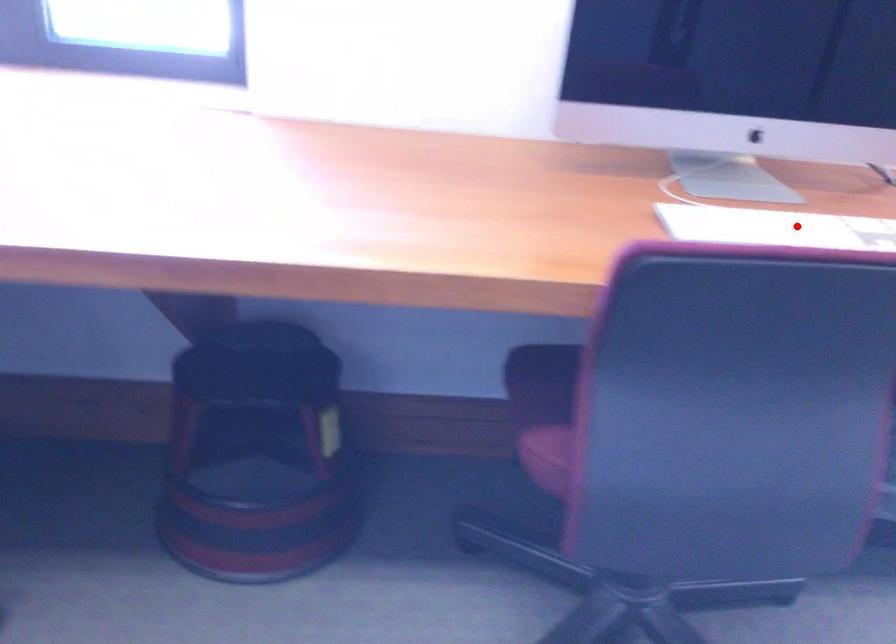
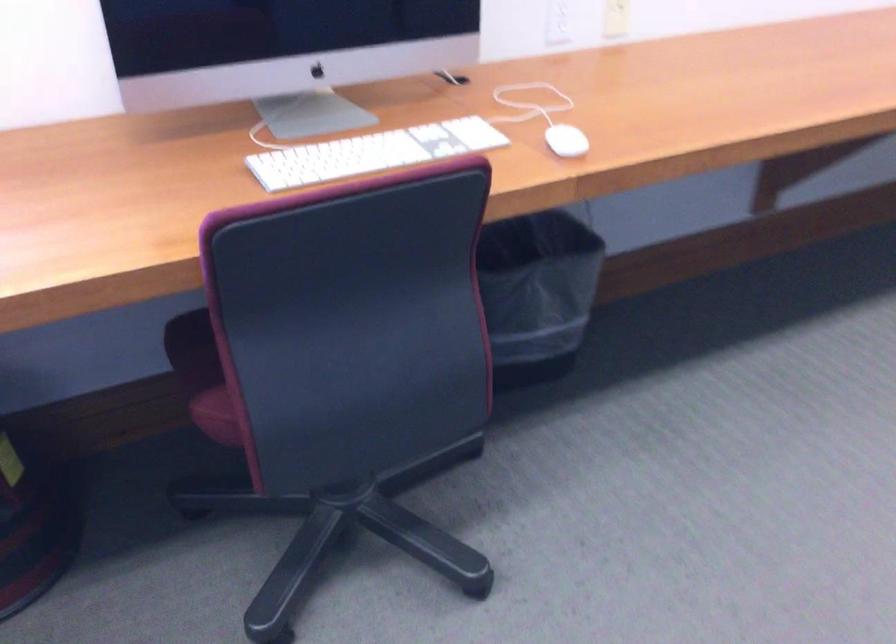
Locate, in the second image, the point that corresponds to the highlighted location in the first image.

(372, 153)